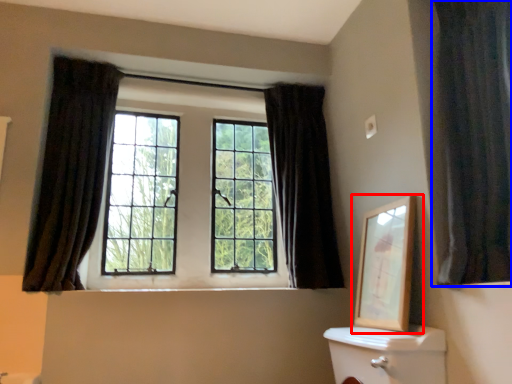
Question: Which of the following is the farthest to the observer, picture frame (highlighted by a red box) or curtain (highlighted by a blue box)?

Choices:
 (A) picture frame
 (B) curtain

Answer: (A)